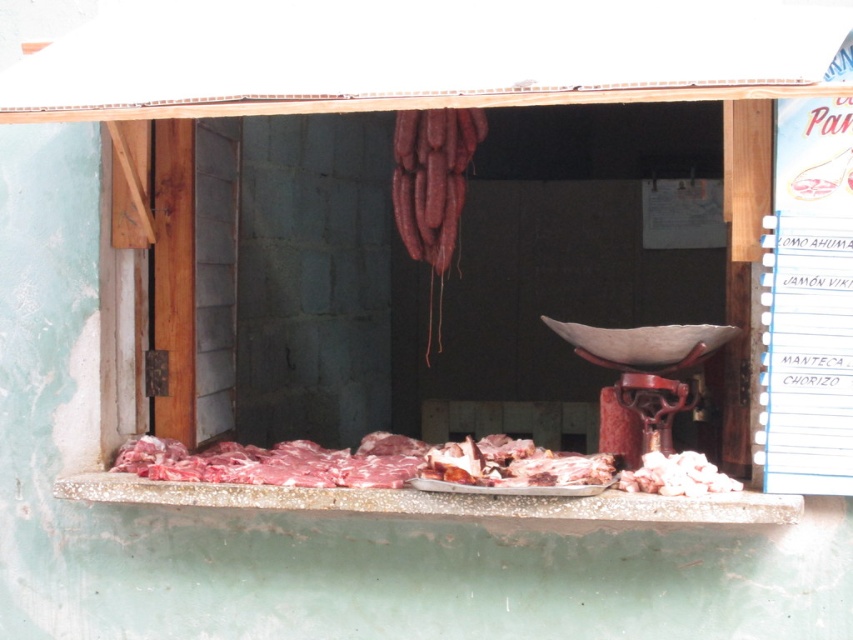
Question: Among these objects, which one is nearest to the camera?

Choices:
 (A) pink raw meat at lower right
 (B) smooth concrete meat at center

Answer: (B)

Question: Where is smooth concrete meat at center located in relation to pink raw meat at lower right in the image?

Choices:
 (A) below
 (B) above

Answer: (A)

Question: Is smooth concrete meat at center to the left of pink raw meat at lower right from the viewer's perspective?

Choices:
 (A) no
 (B) yes

Answer: (B)

Question: Which of the following is the farthest from the observer?

Choices:
 (A) (796, 499)
 (B) (685, 467)

Answer: (B)

Question: Does smooth concrete meat at center have a lesser width compared to pink raw meat at lower right?

Choices:
 (A) yes
 (B) no

Answer: (B)